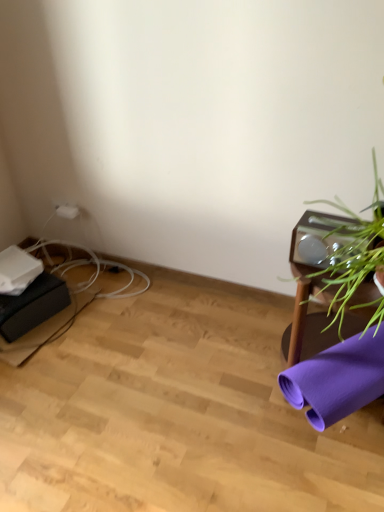
Question: Is purple fabric yoga mat at lower right completely or partially inside white plastic plug at upper left?

Choices:
 (A) yes
 (B) no

Answer: (B)

Question: Does white plastic plug at upper left lie behind purple fabric yoga mat at lower right?

Choices:
 (A) no
 (B) yes

Answer: (B)

Question: Does white plastic plug at upper left have a smaller size compared to purple fabric yoga mat at lower right?

Choices:
 (A) yes
 (B) no

Answer: (A)

Question: From the image's perspective, would you say white plastic plug at upper left is shown under purple fabric yoga mat at lower right?

Choices:
 (A) no
 (B) yes

Answer: (A)

Question: Is white plastic plug at upper left facing away from purple fabric yoga mat at lower right?

Choices:
 (A) no
 (B) yes

Answer: (A)

Question: From a real-world perspective, is white plastic plug at upper left on top of purple fabric yoga mat at lower right?

Choices:
 (A) yes
 (B) no

Answer: (A)

Question: From a real-world perspective, is green leafy plant at right over purple fabric yoga mat at lower right?

Choices:
 (A) no
 (B) yes

Answer: (B)

Question: Does green leafy plant at right appear on the left side of purple fabric yoga mat at lower right?

Choices:
 (A) yes
 (B) no

Answer: (A)

Question: Is green leafy plant at right completely or partially outside of purple fabric yoga mat at lower right?

Choices:
 (A) no
 (B) yes

Answer: (B)

Question: Does green leafy plant at right have a lesser width compared to purple fabric yoga mat at lower right?

Choices:
 (A) no
 (B) yes

Answer: (B)

Question: From the image's perspective, is green leafy plant at right under purple fabric yoga mat at lower right?

Choices:
 (A) no
 (B) yes

Answer: (A)

Question: Is green leafy plant at right shorter than purple fabric yoga mat at lower right?

Choices:
 (A) yes
 (B) no

Answer: (B)

Question: Is purple fabric yoga mat at lower right closer to camera compared to white plastic plug at upper left?

Choices:
 (A) yes
 (B) no

Answer: (A)